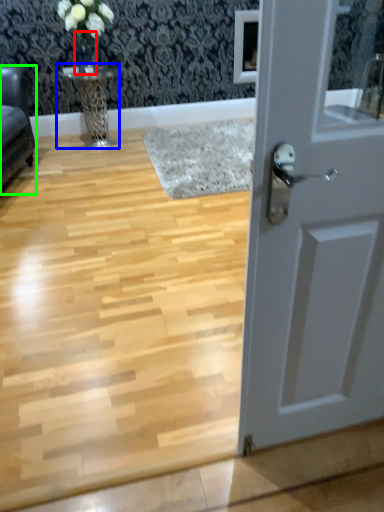
Question: Which is nearer to the glass vase (highlighted by a red box)? table (highlighted by a blue box) or furniture (highlighted by a green box).

Choices:
 (A) table
 (B) furniture

Answer: (A)